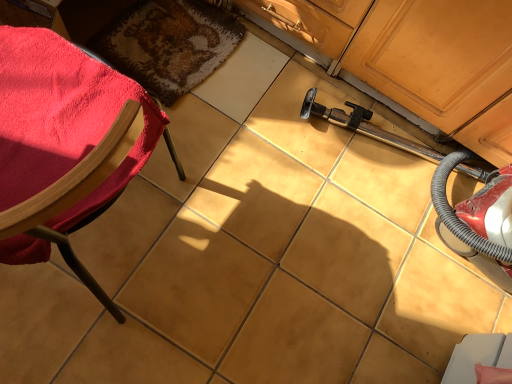
This screenshot has width=512, height=384. I want to click on velvet red chair at left, so click(66, 145).

The image size is (512, 384). What do you see at coordinates (66, 145) in the screenshot?
I see `velvet red chair at left` at bounding box center [66, 145].

I want to click on shaggy brown rug at upper left, so click(169, 44).

Describe the element at coordinates (169, 44) in the screenshot. I see `shaggy brown rug at upper left` at that location.

Find the location of a particular element. This screenshot has height=384, width=512. velvet red chair at left is located at coordinates (66, 145).

Is velvet red chair at left at the right side of shaggy brown rug at upper left?

No.

Which is in front, velvet red chair at left or shaggy brown rug at upper left?

Positioned in front is velvet red chair at left.

Considering the points (140, 102) and (130, 38), which point is in front, point (140, 102) or point (130, 38)?

The point (140, 102) is more forward.

From the image's perspective, which is above, velvet red chair at left or shaggy brown rug at upper left?

shaggy brown rug at upper left.

From a real-world perspective, is velvet red chair at left positioned above or below shaggy brown rug at upper left?

velvet red chair at left is situated higher than shaggy brown rug at upper left in the real world.

Does velvet red chair at left have a greater width compared to shaggy brown rug at upper left?

Yes.

Can you confirm if velvet red chair at left is shorter than shaggy brown rug at upper left?

In fact, velvet red chair at left may be taller than shaggy brown rug at upper left.

Is velvet red chair at left smaller than shaggy brown rug at upper left?

Incorrect, velvet red chair at left is not smaller in size than shaggy brown rug at upper left.

Is velvet red chair at left completely or partially outside of shaggy brown rug at upper left?

Yes, velvet red chair at left is not within shaggy brown rug at upper left.

Are velvet red chair at left and shaggy brown rug at upper left located far from each other?

That's not correct — velvet red chair at left is a little close to shaggy brown rug at upper left.

Is velvet red chair at left turned away from shaggy brown rug at upper left?

No, velvet red chair at left is not facing away from shaggy brown rug at upper left.

In the image, there is a velvet red chair at left. Where is `mat below it (from a real-world perspective)`? mat below it (from a real-world perspective) is located at coordinates (169, 44).

Which object is positioned more to the left, shaggy brown rug at upper left or velvet red chair at left?

velvet red chair at left.

Considering the positions of objects shaggy brown rug at upper left and velvet red chair at left in the image provided, who is behind, shaggy brown rug at upper left or velvet red chair at left?

shaggy brown rug at upper left is further away from the camera.

Which point is more forward, [198,74] or [82,60]?

Positioned in front is point [82,60].

From the image's perspective, relative to velvet red chair at left, is shaggy brown rug at upper left above or below?

Based on their image positions, shaggy brown rug at upper left is located above velvet red chair at left.

From a real-world perspective, is shaggy brown rug at upper left on velvet red chair at left?

Actually, shaggy brown rug at upper left is physically below velvet red chair at left in the real world.

Between shaggy brown rug at upper left and velvet red chair at left, which one has larger width?

Wider between the two is velvet red chair at left.

Who is shorter, shaggy brown rug at upper left or velvet red chair at left?

shaggy brown rug at upper left.

Between shaggy brown rug at upper left and velvet red chair at left, which one has smaller size?

With smaller size is shaggy brown rug at upper left.

Is shaggy brown rug at upper left not inside velvet red chair at left?

Absolutely, shaggy brown rug at upper left is external to velvet red chair at left.

Based on the photo, is shaggy brown rug at upper left directly adjacent to velvet red chair at left?

No, shaggy brown rug at upper left is not beside velvet red chair at left.

Is shaggy brown rug at upper left facing towards velvet red chair at left?

Yes, shaggy brown rug at upper left is turned towards velvet red chair at left.

How distant is shaggy brown rug at upper left from velvet red chair at left?

shaggy brown rug at upper left and velvet red chair at left are 23.18 inches apart from each other.

Identify the location of chair that is below the shaggy brown rug at upper left (from the image's perspective). The image size is (512, 384). (66, 145).

Find the location of a particular element. chair lying below the shaggy brown rug at upper left (from the image's perspective) is located at coordinates (66, 145).

The width and height of the screenshot is (512, 384). Identify the location of chair to the left of shaggy brown rug at upper left. (66, 145).